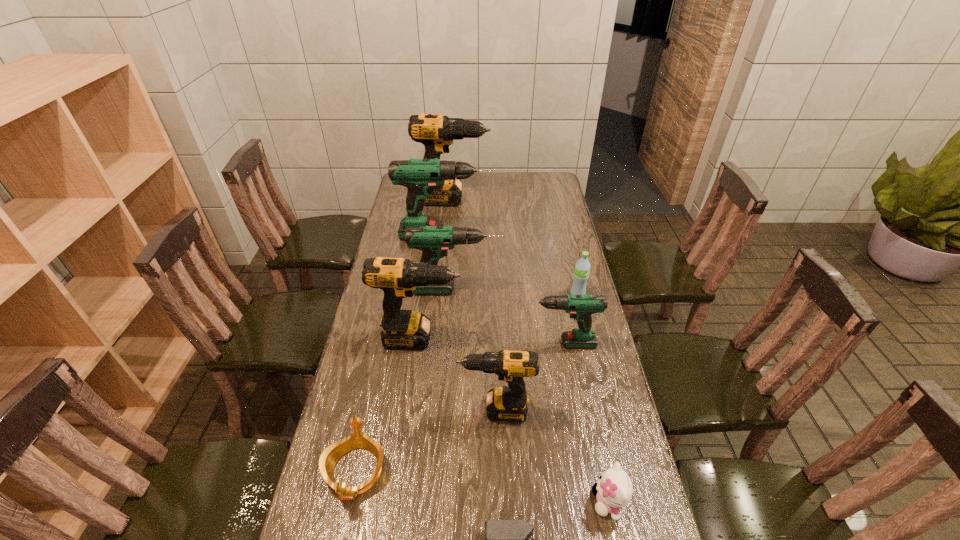
You are a GUI agent. You are given a task and a screenshot of the screen. Output one action in this format:
    pyautogui.click(x=<x>, y=<y>)
    Task: Click on the free location located 0.260m at the tip of the nearest black drill
    
    Given the screenshot: What is the action you would take?
    pyautogui.click(x=369, y=410)

Identify the location of blank space located 0.070m at the tip of the nearest black drill. (435, 410).

Locate an element on the screen. The image size is (960, 540). blank area located 0.210m on the handle side of the rightmost green drill is located at coordinates (458, 343).

Locate an element on the screen. vacant space located on the handle side of the rightmost green drill is located at coordinates pyautogui.click(x=440, y=343).

Find the location of a particular element. vacant space located on the handle side of the rightmost green drill is located at coordinates (500, 343).

Identify the location of free location located on the left of the water bottle. (466, 294).

Find the location of a particular element. This screenshot has width=960, height=540. free location located on the front-facing side of the kitten is located at coordinates (527, 502).

The height and width of the screenshot is (540, 960). Identify the location of blank space located 0.090m on the front-facing side of the kitten. [555, 502].

Where is `blank space located 0.170m on the front-facing side of the kitten`? The width and height of the screenshot is (960, 540). blank space located 0.170m on the front-facing side of the kitten is located at coordinates (522, 502).

At what (x,y) coordinates should I click in order to perform the action: click on object situated at the far edge. Please return your answer as a coordinate pair (x, y). The width and height of the screenshot is (960, 540). Looking at the image, I should click on (436, 132).